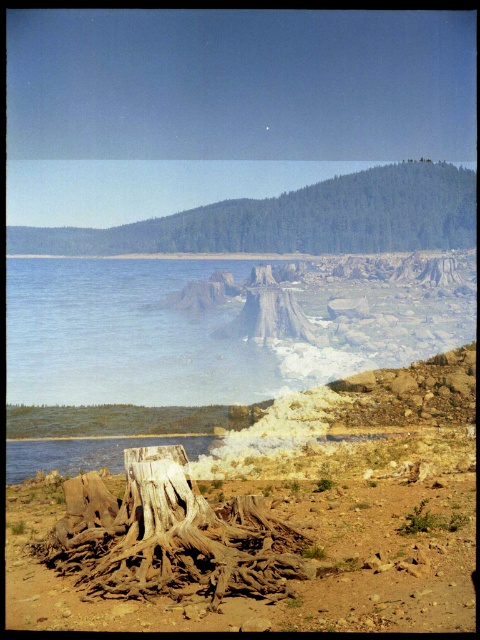
Question: Which point is farther to the camera?

Choices:
 (A) (64, 483)
 (B) (441, 556)
 (C) (46, 237)

Answer: (C)

Question: Does brown rough tree roots at lower center have a larger size compared to brown textured tree stump at center?

Choices:
 (A) yes
 (B) no

Answer: (B)

Question: Can you confirm if brown rough tree roots at lower center is bigger than light brown wood at center?

Choices:
 (A) no
 (B) yes

Answer: (A)

Question: Which point is farther to the camera?

Choices:
 (A) (131, 451)
 (B) (279, 630)
 (C) (181, 243)

Answer: (C)

Question: Is light brown wood at center smaller than brown textured tree stump at center?

Choices:
 (A) no
 (B) yes

Answer: (B)

Question: Which object is the closest to the brown textured tree stump at center?

Choices:
 (A) light brown wood at center
 (B) brown rough tree roots at lower center

Answer: (A)